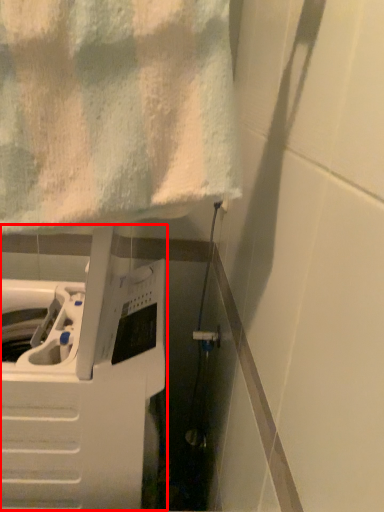
Question: Where is appliance (annotated by the red box) located in relation to towel in the image?

Choices:
 (A) right
 (B) left

Answer: (B)